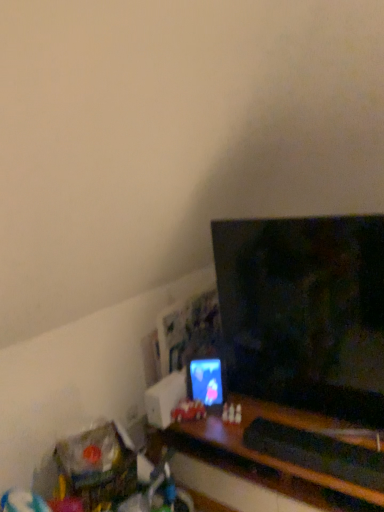
Describe the element at coordinates (188, 411) in the screenshot. I see `translucent plastic toy at center` at that location.

Measure the distance between point (x=213, y=367) and camera.

A distance of 6.83 feet exists between point (x=213, y=367) and camera.

The height and width of the screenshot is (512, 384). Identify the location of translucent plastic toy at center. (188, 411).

Is translucent plastic toy at center positioned in front of matte plastic phone at center?

Yes, it is in front of matte plastic phone at center.

From the image's perspective, does translucent plastic toy at center appear higher than matte plastic phone at center?

No, from the image's perspective, translucent plastic toy at center is not over matte plastic phone at center.

Is translucent plastic toy at center surrounding matte plastic phone at center?

No, translucent plastic toy at center does not contain matte plastic phone at center.

Is translucent plastic toy at center taller than matte plastic phone at center?

Incorrect, the height of translucent plastic toy at center is not larger of that of matte plastic phone at center.

Is black glossy tv at center not near matte plastic phone at center?

No.

How different are the orientations of black glossy tv at center and matte plastic phone at center in degrees?

The angle between the facing direction of black glossy tv at center and the facing direction of matte plastic phone at center is 29.1 degrees.

Considering the positions of objects black glossy tv at center and matte plastic phone at center in the image provided, who is more to the right, black glossy tv at center or matte plastic phone at center?

From the viewer's perspective, black glossy tv at center appears more on the right side.

Locate an element on the screen. television above the matte plastic phone at center (from the image's perspective) is located at coordinates (305, 312).

From a real-world perspective, is black glossy tv at center above or below translucent plastic toy at center?

From a real-world perspective, black glossy tv at center is physically above translucent plastic toy at center.

Considering the relative positions of black glossy tv at center and translucent plastic toy at center in the image provided, is black glossy tv at center to the left of translucent plastic toy at center from the viewer's perspective?

→ In fact, black glossy tv at center is to the right of translucent plastic toy at center.

What's the angular difference between black glossy tv at center and translucent plastic toy at center's facing directions?

They differ by 38.7 degrees in their facing directions.

Which of these two, black glossy tv at center or translucent plastic toy at center, stands shorter?

translucent plastic toy at center.

This screenshot has width=384, height=512. I want to click on toy beneath the matte plastic phone at center (from a real-world perspective), so click(x=188, y=411).

Does matte plastic phone at center have a lesser width compared to translucent plastic toy at center?

No, matte plastic phone at center is not thinner than translucent plastic toy at center.

Can you confirm if matte plastic phone at center is taller than translucent plastic toy at center?

Yes, matte plastic phone at center is taller than translucent plastic toy at center.

Does matte plastic phone at center lie in front of translucent plastic toy at center?

No, it is behind translucent plastic toy at center.

Are translucent plastic toy at center and black glossy tv at center far apart?

They are positioned close to each other.

You are a GUI agent. You are given a task and a screenshot of the screen. Output one action in this format:
    pyautogui.click(x=<x>, y=<y>)
    Task: Click on the toy on the left of black glossy tv at center
    The width and height of the screenshot is (384, 512).
    Given the screenshot: What is the action you would take?
    pyautogui.click(x=188, y=411)

In the scene shown: In terms of height, does translucent plastic toy at center look taller or shorter compared to black glossy tv at center?

translucent plastic toy at center is shorter than black glossy tv at center.

Which is nearer, (219,394) or (261,399)?

The point (261,399) is closer to the camera.

Between matte plastic phone at center and black glossy tv at center, which one has smaller size?

matte plastic phone at center is smaller.

Can you tell me how much matte plastic phone at center and black glossy tv at center differ in facing direction?

29.1 degrees.

Does matte plastic phone at center appear on the left side of black glossy tv at center?

Yes.

I want to click on toy in front of the matte plastic phone at center, so click(x=188, y=411).

Where is `computer monitor beneath the black glossy tv at center (from a real-world perspective)`? computer monitor beneath the black glossy tv at center (from a real-world perspective) is located at coordinates (205, 381).

Considering their positions, is matte plastic phone at center positioned further to translucent plastic toy at center than black glossy tv at center?

black glossy tv at center.

Based on the photo, considering their positions, is black glossy tv at center positioned further to translucent plastic toy at center than matte plastic phone at center?

black glossy tv at center is further to translucent plastic toy at center.

From the image, which object appears to be nearer to black glossy tv at center, translucent plastic toy at center or matte plastic phone at center?

matte plastic phone at center lies closer to black glossy tv at center than the other object.

When comparing their distances from black glossy tv at center, does matte plastic phone at center or translucent plastic toy at center seem further?

translucent plastic toy at center is further to black glossy tv at center.

Consider the image. Based on their spatial positions, is black glossy tv at center or translucent plastic toy at center further from matte plastic phone at center?

black glossy tv at center is further to matte plastic phone at center.

Based on their spatial positions, is translucent plastic toy at center or black glossy tv at center closer to matte plastic phone at center?

The object closer to matte plastic phone at center is translucent plastic toy at center.

The height and width of the screenshot is (512, 384). In order to click on toy between black glossy tv at center and matte plastic phone at center from front to back in this screenshot , I will do `click(188, 411)`.